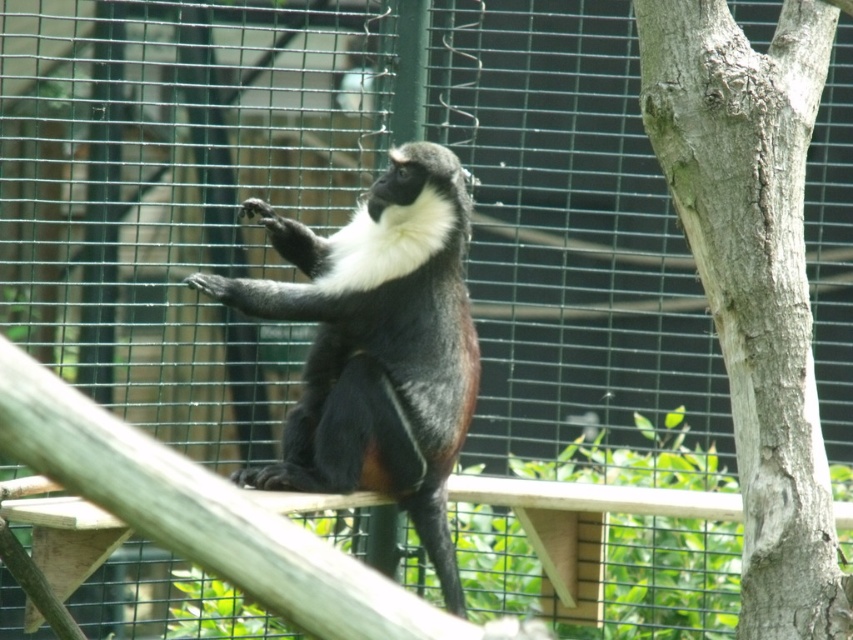
Question: Does smooth gray bark at right have a greater width compared to shiny black fur monkey at center?

Choices:
 (A) no
 (B) yes

Answer: (A)

Question: Can you confirm if smooth gray bark at right is positioned above shiny black fur monkey at center?

Choices:
 (A) no
 (B) yes

Answer: (B)

Question: Among these objects, which one is farthest from the camera?

Choices:
 (A) shiny black fur monkey at center
 (B) smooth gray bark at right

Answer: (A)

Question: Among these points, which one is farthest from the camera?

Choices:
 (A) (294, 456)
 (B) (790, 280)

Answer: (A)

Question: Does smooth gray bark at right come behind shiny black fur monkey at center?

Choices:
 (A) yes
 (B) no

Answer: (B)

Question: Which of the following is the closest to the observer?

Choices:
 (A) (299, 232)
 (B) (827, 10)

Answer: (B)